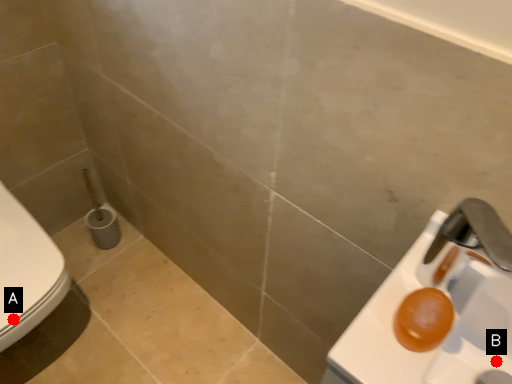
Question: Two points are circled on the image, labeled by A and B beside each circle. Which point is closer to the camera taking this photo?

Choices:
 (A) A is closer
 (B) B is closer

Answer: (B)